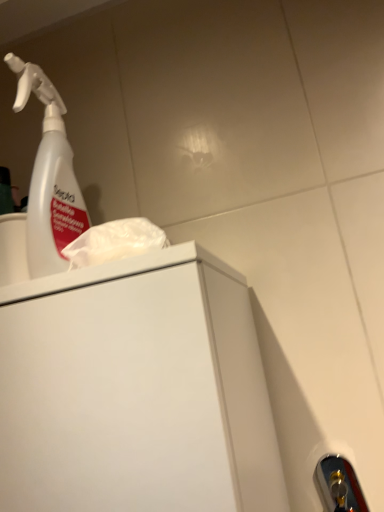
Question: Is transparent plastic spray bottle at upper left taller than gold metallic door handle at lower right?

Choices:
 (A) yes
 (B) no

Answer: (A)

Question: Considering the relative sizes of transparent plastic spray bottle at upper left and gold metallic door handle at lower right in the image provided, is transparent plastic spray bottle at upper left bigger than gold metallic door handle at lower right?

Choices:
 (A) no
 (B) yes

Answer: (B)

Question: Is transparent plastic spray bottle at upper left positioned with its back to gold metallic door handle at lower right?

Choices:
 (A) no
 (B) yes

Answer: (A)

Question: From the image's perspective, is transparent plastic spray bottle at upper left beneath gold metallic door handle at lower right?

Choices:
 (A) no
 (B) yes

Answer: (A)

Question: From a real-world perspective, is transparent plastic spray bottle at upper left positioned over gold metallic door handle at lower right based on gravity?

Choices:
 (A) no
 (B) yes

Answer: (B)

Question: From the image's perspective, is transparent plastic spray bottle at upper left located above gold metallic door handle at lower right?

Choices:
 (A) no
 (B) yes

Answer: (B)

Question: Does gold metallic door handle at lower right have a greater width compared to transparent plastic spray bottle at upper left?

Choices:
 (A) no
 (B) yes

Answer: (A)

Question: Considering the relative sizes of gold metallic door handle at lower right and transparent plastic spray bottle at upper left in the image provided, is gold metallic door handle at lower right shorter than transparent plastic spray bottle at upper left?

Choices:
 (A) no
 (B) yes

Answer: (B)

Question: From a real-world perspective, is gold metallic door handle at lower right below transparent plastic spray bottle at upper left?

Choices:
 (A) yes
 (B) no

Answer: (A)

Question: Is gold metallic door handle at lower right with transparent plastic spray bottle at upper left?

Choices:
 (A) no
 (B) yes

Answer: (A)

Question: Is gold metallic door handle at lower right completely or partially outside of transparent plastic spray bottle at upper left?

Choices:
 (A) yes
 (B) no

Answer: (A)

Question: Is gold metallic door handle at lower right turned away from transparent plastic spray bottle at upper left?

Choices:
 (A) yes
 (B) no

Answer: (B)

Question: Is transparent plastic spray bottle at upper left bigger or smaller than gold metallic door handle at lower right?

Choices:
 (A) small
 (B) big

Answer: (B)